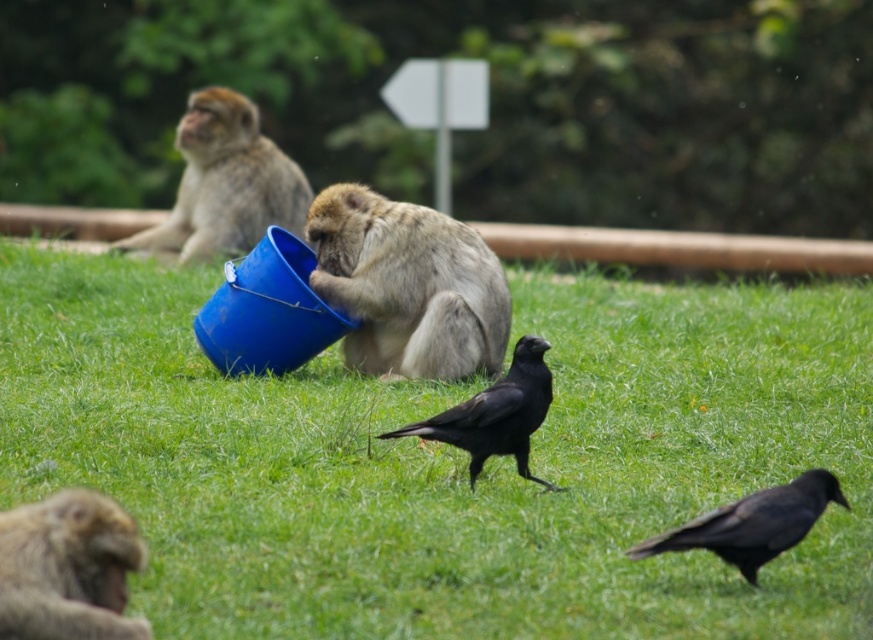
Question: Among these points, which one is nearest to the camera?

Choices:
 (A) (385, 348)
 (B) (540, 422)
 (C) (225, 529)

Answer: (C)

Question: Does green grass at center come behind furry beige monkey at upper left?

Choices:
 (A) yes
 (B) no

Answer: (B)

Question: Which point is farther from the camera taking this photo?

Choices:
 (A) (245, 228)
 (B) (535, 385)

Answer: (A)

Question: Which of the following is the farthest from the observer?

Choices:
 (A) (104, 572)
 (B) (190, 145)
 (C) (496, 452)
 (D) (775, 492)

Answer: (B)

Question: Can you confirm if furry beige monkey at upper left is thinner than black glossy crow at lower right?

Choices:
 (A) yes
 (B) no

Answer: (B)

Question: Is brown furry monkey at lower left smaller than furry beige monkey at upper left?

Choices:
 (A) no
 (B) yes

Answer: (B)